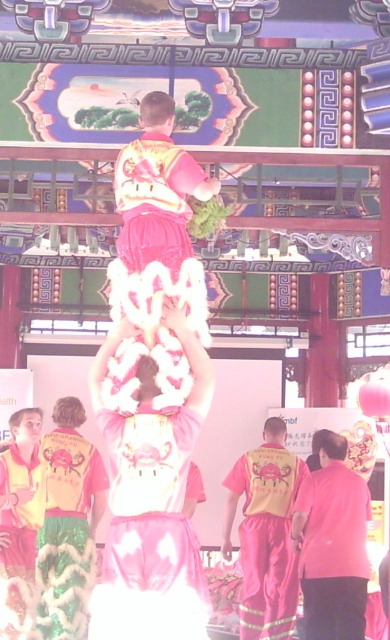
Question: Is yellow reflective fabric pants at center to the left of green sequined fabric at lower left from the viewer's perspective?

Choices:
 (A) no
 (B) yes

Answer: (A)

Question: Which of the following is the closest to the observer?

Choices:
 (A) green sequined fabric at lower left
 (B) pink fabric at center
 (C) yellow reflective fabric pants at center
 (D) velvet pink skirt at lower left

Answer: (D)

Question: Which object is positioned closest to the yellow reflective fabric pants at center?

Choices:
 (A) pink fabric at center
 (B) green sequined fabric at lower left
 (C) pink satin costume at center

Answer: (A)

Question: Which point appears closest to the camera in this image?

Choices:
 (A) [23, 484]
 (B) [56, 545]

Answer: (A)

Question: Is pink fabric at center above yellow reflective fabric pants at center?

Choices:
 (A) no
 (B) yes

Answer: (B)

Question: Does pink satin costume at center appear over green sequined fabric at lower left?

Choices:
 (A) yes
 (B) no

Answer: (A)